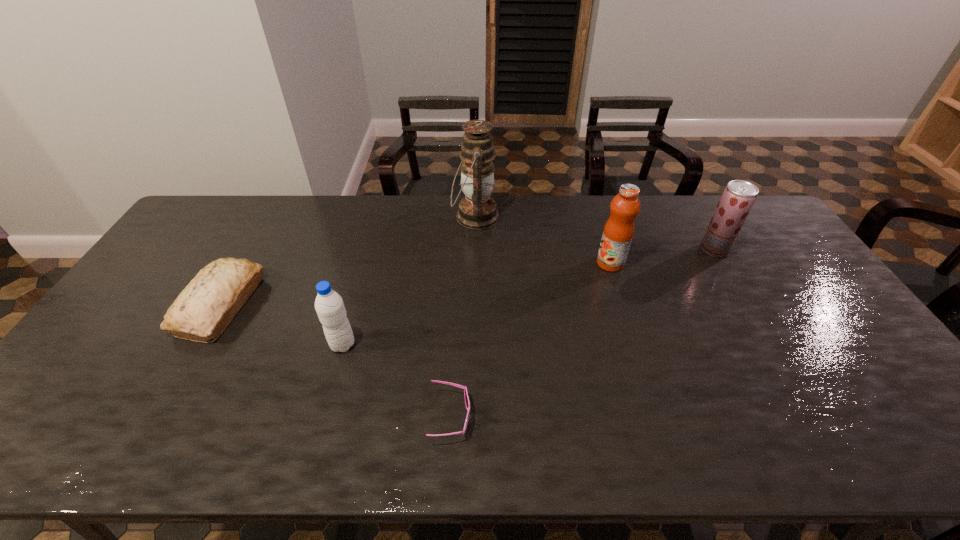
The height and width of the screenshot is (540, 960). In order to click on lantern in this screenshot , I will do pos(477,210).

This screenshot has height=540, width=960. What are the coordinates of `the farthest object` in the screenshot? It's located at (477, 210).

This screenshot has height=540, width=960. What are the coordinates of `the left fruit juice` in the screenshot? It's located at (618, 232).

Find the location of `the shorter fruit juice`. the shorter fruit juice is located at coordinates (738, 197).

Find the location of a particular element. The width and height of the screenshot is (960, 540). the rightmost object is located at coordinates (738, 197).

Find the location of a particular element. Image resolution: width=960 pixels, height=540 pixels. the fifth object from right to left is located at coordinates (329, 305).

I want to click on the leftmost object, so click(206, 306).

What are the coordinates of `the fifth tallest object` in the screenshot? It's located at (206, 306).

Where is `the nearest object`? This screenshot has height=540, width=960. the nearest object is located at coordinates (467, 402).

In order to click on the shortest object in this screenshot , I will do `click(467, 402)`.